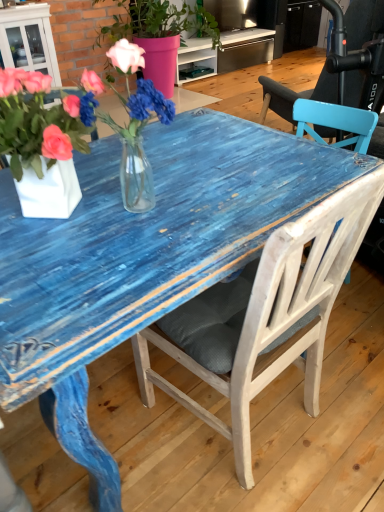
Question: From a real-world perspective, relative to white wood chair at center, is translucent glass vase at center vertically above or below?

Choices:
 (A) above
 (B) below

Answer: (A)

Question: In terms of height, does translucent glass vase at center look taller or shorter compared to white wood chair at center?

Choices:
 (A) tall
 (B) short

Answer: (B)

Question: Estimate the real-world distances between objects in this image. Which object is farther from the white matte vase at left, arranged as the 1th houseplant when viewed from the front?

Choices:
 (A) translucent glass vase at center
 (B) pink matte vase at upper center, which is the first houseplant in back-to-front order
 (C) white wood chair at center

Answer: (B)

Question: Estimate the real-world distances between objects in this image. Which object is closer to the white wood chair at center?

Choices:
 (A) white matte vase at left, the 2th houseplant in the top-to-bottom sequence
 (B) translucent glass vase at center
 (C) pink matte vase at upper center, the first houseplant in the top-to-bottom sequence

Answer: (B)